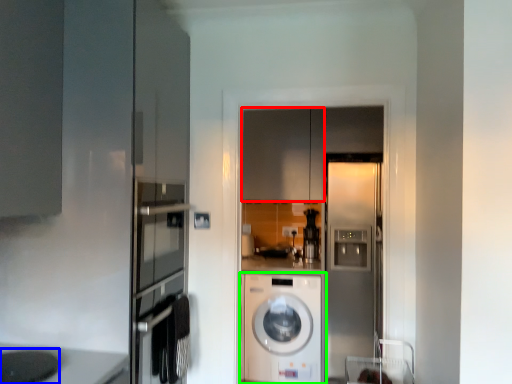
Question: Estimate the real-world distances between objects in this image. Which object is closer to cabinetry (highlighted by a red box), appliance (highlighted by a blue box) or washing machine (highlighted by a green box)?

Choices:
 (A) appliance
 (B) washing machine

Answer: (B)